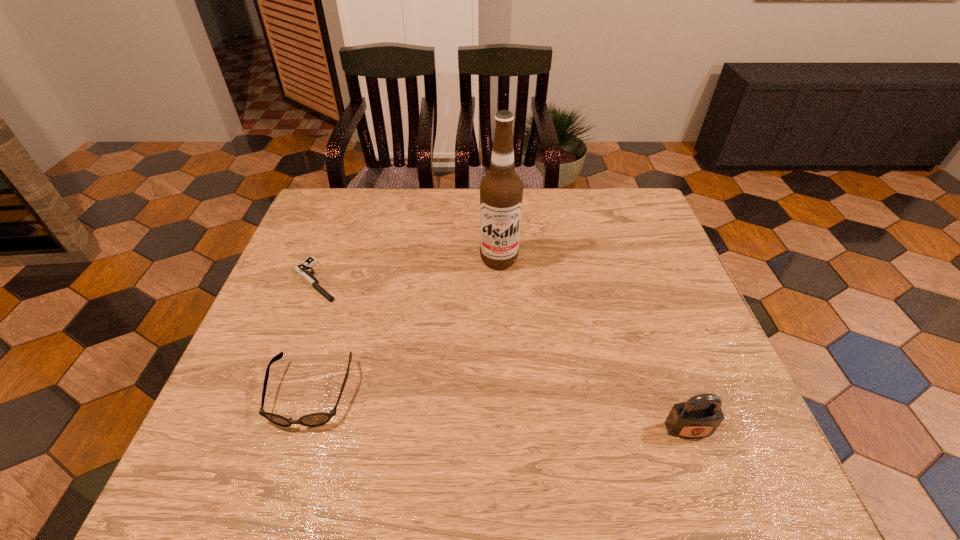
At what (x,y) coordinates should I click in order to perform the action: click on free spot on the desktop that is between the sunglasses and the padlock and is positioned on the label of the alcohol. Please return your answer as a coordinate pair (x, y). This screenshot has height=540, width=960. Looking at the image, I should click on (509, 412).

Where is `free spot on the desktop that is between the third tallest object and the third shortest object and is positioned on the front-facing side of the pistol`? The width and height of the screenshot is (960, 540). free spot on the desktop that is between the third tallest object and the third shortest object and is positioned on the front-facing side of the pistol is located at coordinates (468, 409).